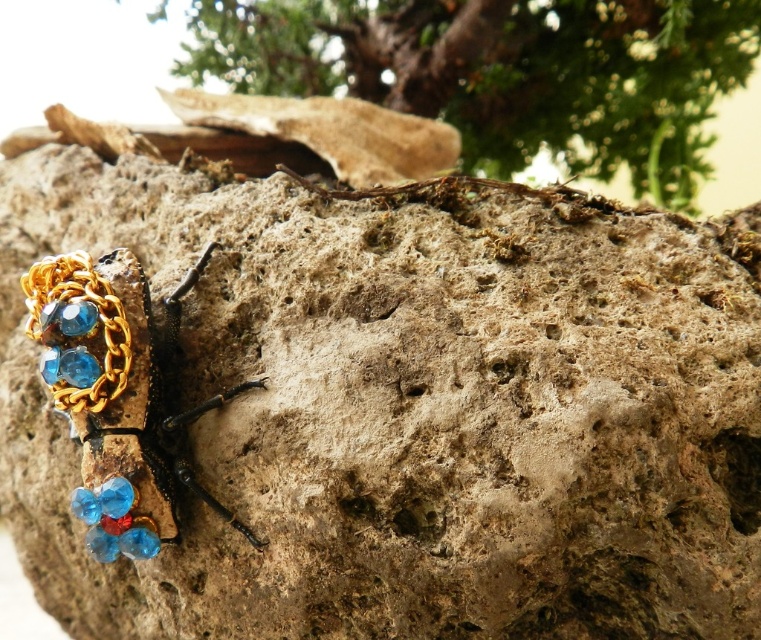
You are a photographer trying to capture the rock and the insect. You want to ensure the green leafy tree at upper center is visible in the background. Based on its position, can you confirm if the tree is located above or below the center of the image?

The green leafy tree at upper center is positioned at point (505,72). Since the y coordinate is 0.664, which is above the center point of 0.5, the tree is located above the center of the image.

Based on the photo, you are a photographer holding a camera. You want to capture a close up of the green leafy tree at upper center. The camera is currently positioned 1.55 meters away from the tree. If you move the camera forward by 0.5 meters, will the tree appear larger in the photo?

Moving the camera forward by 0.5 meters reduces the distance to 1.05 meters. Since objects appear larger when closer to the camera, the green leafy tree at upper center will appear larger in the photo.

You are an entomologist observing the rock surface. You notice the gold chain and gemstone beetle at left and the green leafy tree at upper center. Which object is taller?

The green leafy tree at upper center is much taller than the gold chain and gemstone beetle at left.